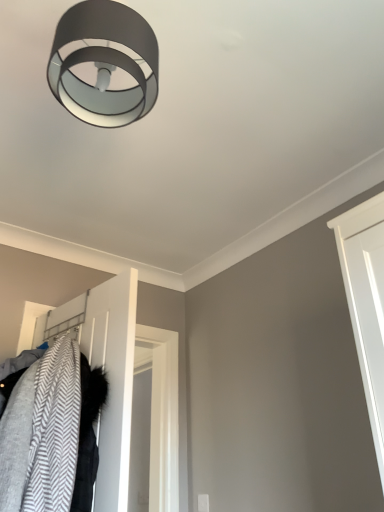
Question: Considering the relative sizes of matte gray ring light at upper center and white matte door at lower left in the image provided, is matte gray ring light at upper center thinner than white matte door at lower left?

Choices:
 (A) no
 (B) yes

Answer: (A)

Question: From the image's perspective, would you say matte gray ring light at upper center is positioned over white matte door at lower left?

Choices:
 (A) yes
 (B) no

Answer: (A)

Question: Does matte gray ring light at upper center have a greater height compared to white matte door at lower left?

Choices:
 (A) no
 (B) yes

Answer: (A)

Question: Is matte gray ring light at upper center next to white matte door at lower left and touching it?

Choices:
 (A) yes
 (B) no

Answer: (B)

Question: Does matte gray ring light at upper center come behind white matte door at lower left?

Choices:
 (A) yes
 (B) no

Answer: (B)

Question: Can you confirm if matte gray ring light at upper center is smaller than white matte door at lower left?

Choices:
 (A) no
 (B) yes

Answer: (B)

Question: Is white matte door at lower left aimed at matte gray ring light at upper center?

Choices:
 (A) yes
 (B) no

Answer: (B)

Question: Does white matte door at lower left have a larger size compared to matte gray ring light at upper center?

Choices:
 (A) yes
 (B) no

Answer: (A)

Question: From the image's perspective, is white matte door at lower left beneath matte gray ring light at upper center?

Choices:
 (A) yes
 (B) no

Answer: (A)

Question: Considering the relative sizes of white matte door at lower left and matte gray ring light at upper center in the image provided, is white matte door at lower left smaller than matte gray ring light at upper center?

Choices:
 (A) yes
 (B) no

Answer: (B)

Question: Considering the relative positions of white matte door at lower left and matte gray ring light at upper center in the image provided, is white matte door at lower left in front of matte gray ring light at upper center?

Choices:
 (A) yes
 (B) no

Answer: (B)

Question: From a real-world perspective, is white matte door at lower left located higher than matte gray ring light at upper center?

Choices:
 (A) yes
 (B) no

Answer: (B)

Question: Looking at their shapes, would you say white matte door at lower left is wider or thinner than matte gray ring light at upper center?

Choices:
 (A) thin
 (B) wide

Answer: (A)